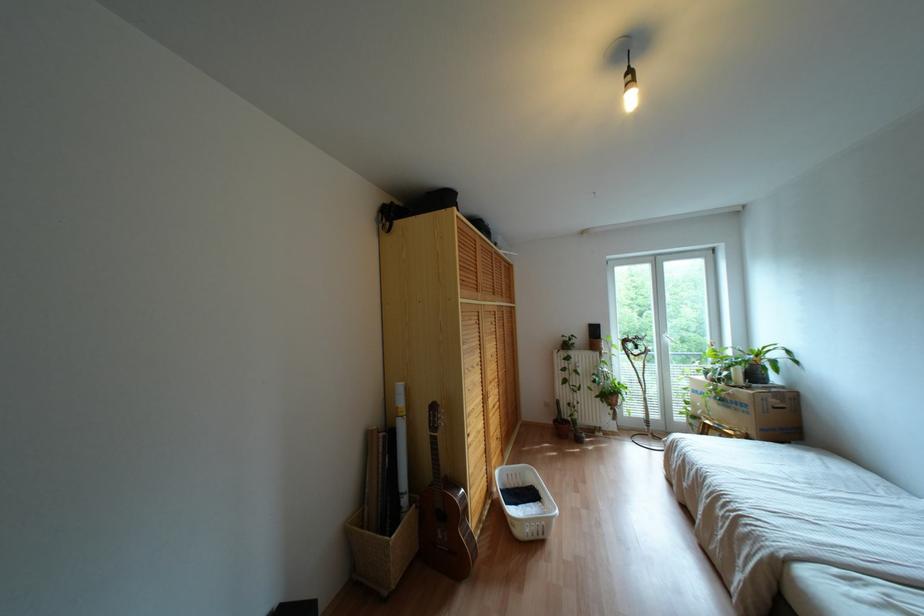
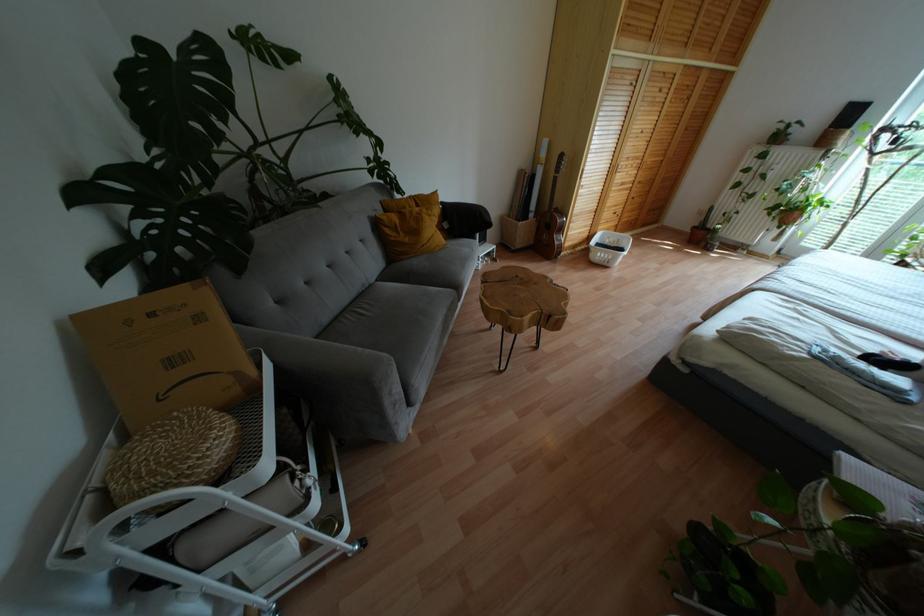
In the second image, find the point that corresponds to [553,421] in the first image.

(694, 227)